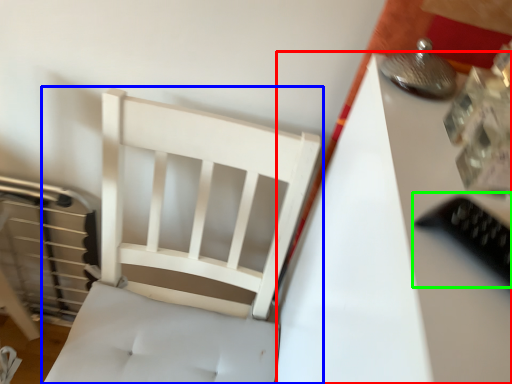
Question: Considering the real-world distances, which object is closest to table (highlighted by a red box)? furniture (highlighted by a blue box) or equipment (highlighted by a green box).

Choices:
 (A) furniture
 (B) equipment

Answer: (B)